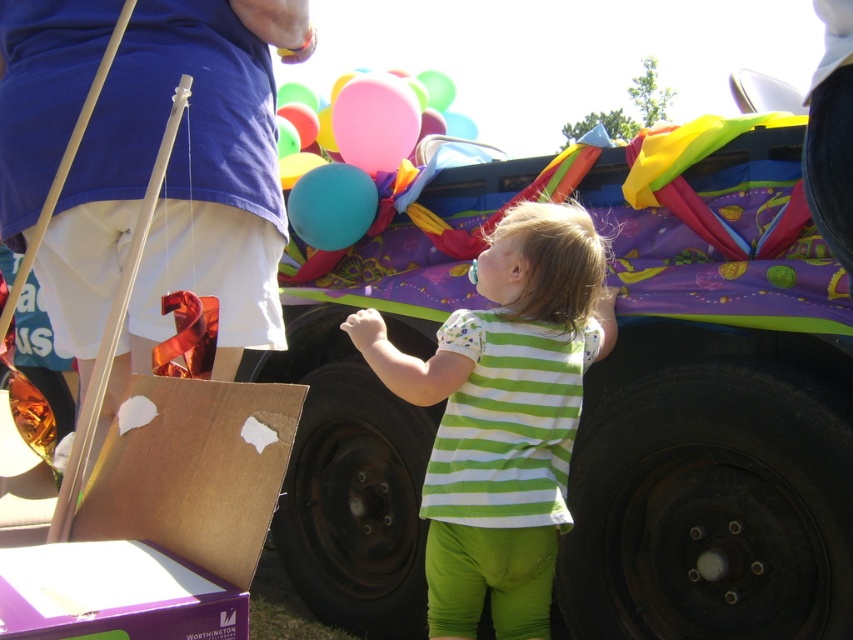
Question: Is the position of green striped shirt at center less distant than that of translucent blue balloon at center?

Choices:
 (A) yes
 (B) no

Answer: (A)

Question: Which object is the farthest from the green striped shirt at center?

Choices:
 (A) matte blue balloon at upper center
 (B) pink rubber balloon at upper center
 (C) translucent blue balloon at center

Answer: (B)

Question: Is green striped shirt at center to the left of pink rubber balloon at upper center from the viewer's perspective?

Choices:
 (A) yes
 (B) no

Answer: (B)

Question: Which object is the farthest from the matte blue balloon at upper center?

Choices:
 (A) translucent blue balloon at center
 (B) brown cardboard box at lower left
 (C) green striped shirt at center

Answer: (B)

Question: Which object appears closest to the camera in this image?

Choices:
 (A) pink rubber balloon at upper center
 (B) translucent blue balloon at center

Answer: (B)

Question: Does brown cardboard box at lower left have a greater width compared to pink rubber balloon at upper center?

Choices:
 (A) yes
 (B) no

Answer: (B)